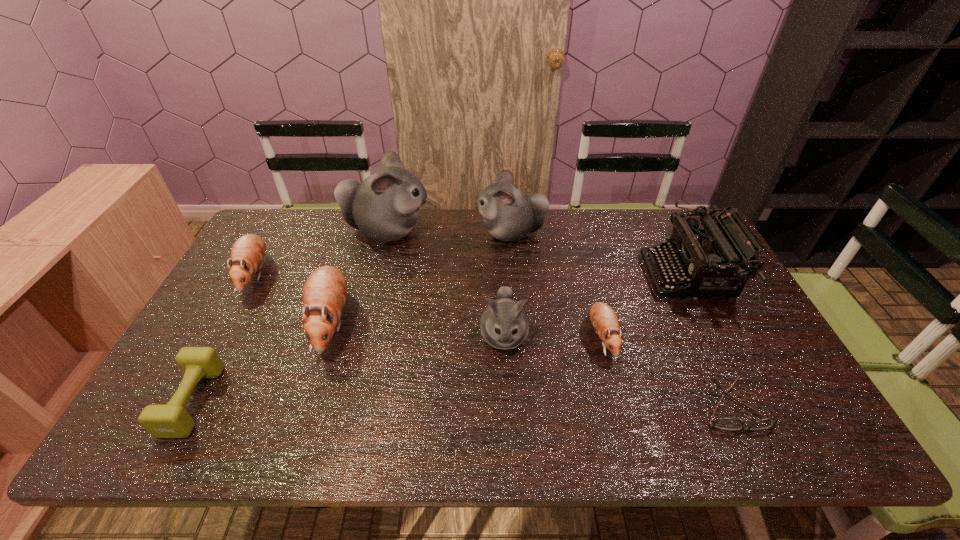
The width and height of the screenshot is (960, 540). I want to click on spectacles present at the right edge, so click(x=723, y=423).

Find the location of a particular element. The width and height of the screenshot is (960, 540). object at the far left corner is located at coordinates (247, 254).

Find the location of a particular element. The width and height of the screenshot is (960, 540). object at the near left corner is located at coordinates (171, 420).

Identify the location of object at the far right corner. (695, 255).

Identify the location of object located at the near right corner. (723, 423).

In the image, there is a desktop. Where is `vacant space at the far edge`? The width and height of the screenshot is (960, 540). vacant space at the far edge is located at coordinates (310, 241).

This screenshot has height=540, width=960. In the image, there is a desktop. In order to click on free space at the near edge in this screenshot , I will do `click(477, 423)`.

Identify the location of blank space at the left edge. Image resolution: width=960 pixels, height=540 pixels. (241, 323).

What are the coordinates of `free space at the right edge of the desktop` in the screenshot? It's located at (799, 401).

The width and height of the screenshot is (960, 540). I want to click on vacant space at the far left corner of the desktop, so tap(313, 214).